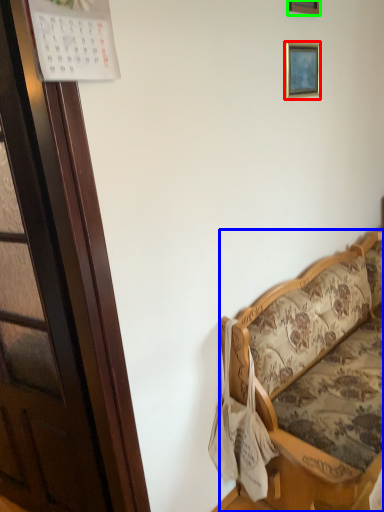
Question: Which is nearer to the picture frame (highlighted by a red box)? studio couch (highlighted by a blue box) or picture frame (highlighted by a green box).

Choices:
 (A) studio couch
 (B) picture frame

Answer: (B)